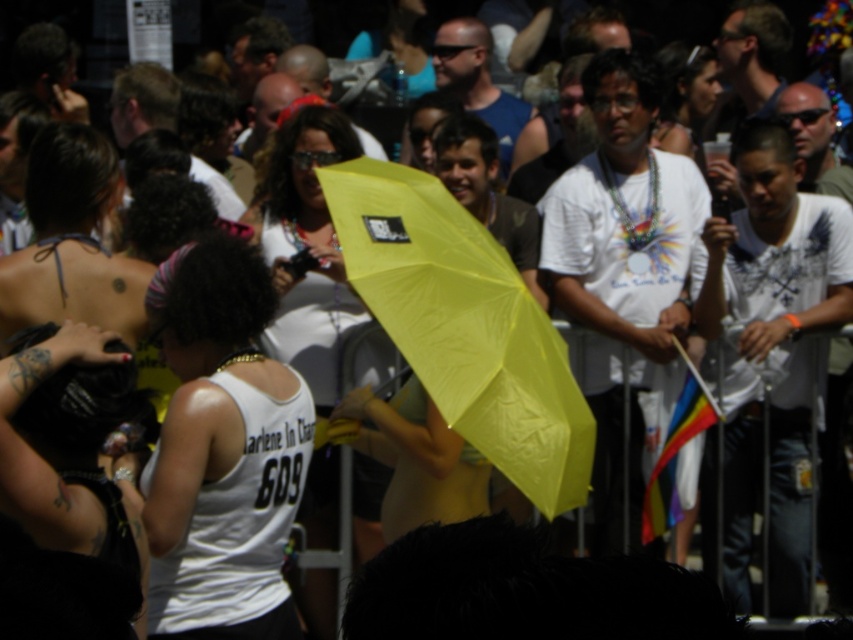
Question: Which point appears closest to the camera in this image?

Choices:
 (A) (216, 474)
 (B) (302, 333)

Answer: (A)

Question: Which of the following is the closest to the observer?

Choices:
 (A) (311, 435)
 (B) (459, 221)

Answer: (A)

Question: Is white matte tank top at center closer to the viewer compared to yellow matte umbrella at center?

Choices:
 (A) yes
 (B) no

Answer: (A)

Question: Is white matte tank top at center positioned in front of yellow matte umbrella at center?

Choices:
 (A) no
 (B) yes

Answer: (B)

Question: Is white matte tank top at center positioned before yellow matte umbrella at center?

Choices:
 (A) yes
 (B) no

Answer: (A)

Question: Which point is farther to the camera?

Choices:
 (A) (294, 416)
 (B) (317, 353)
 (C) (509, 333)

Answer: (B)